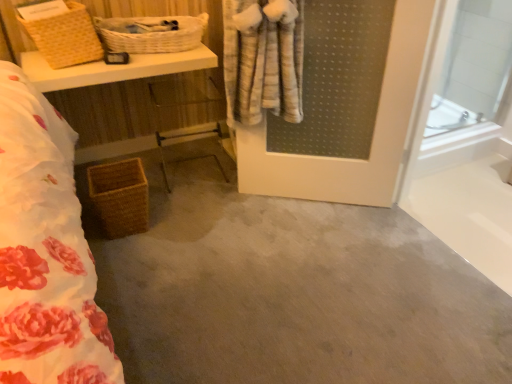
Question: Is woven brown basket at lower left, the third basket in the top-to-bottom sequence, positioned in front of woven wicker basket at lower left?

Choices:
 (A) yes
 (B) no

Answer: (B)

Question: From the image's perspective, is woven brown basket at lower left, which is counted as the 1th basket, starting from the bottom, beneath woven wicker basket at lower left?

Choices:
 (A) no
 (B) yes

Answer: (B)

Question: Is woven brown basket at lower left, the third basket in the top-to-bottom sequence, not close to woven wicker basket at lower left?

Choices:
 (A) yes
 (B) no

Answer: (B)

Question: Considering the relative sizes of woven brown basket at lower left, the third basket in the top-to-bottom sequence, and woven wicker basket at lower left in the image provided, is woven brown basket at lower left, the third basket in the top-to-bottom sequence, bigger than woven wicker basket at lower left?

Choices:
 (A) no
 (B) yes

Answer: (A)

Question: Is woven brown basket at lower left, which is counted as the 1th basket, starting from the bottom, to the right of woven wicker basket at lower left from the viewer's perspective?

Choices:
 (A) no
 (B) yes

Answer: (B)

Question: Is gray carpet at center to the left or to the right of woven brown basket at lower left, which is counted as the 1th basket, starting from the bottom, in the image?

Choices:
 (A) right
 (B) left

Answer: (A)

Question: In the image, is gray carpet at center positioned in front of or behind woven brown basket at lower left, the third basket in the top-to-bottom sequence?

Choices:
 (A) behind
 (B) front

Answer: (B)

Question: Is gray carpet at center spatially inside woven brown basket at lower left, the third basket in the top-to-bottom sequence, or outside of it?

Choices:
 (A) outside
 (B) inside

Answer: (A)

Question: Looking at their shapes, would you say gray carpet at center is wider or thinner than woven brown basket at lower left, which is counted as the 1th basket, starting from the bottom?

Choices:
 (A) thin
 (B) wide

Answer: (B)

Question: Looking at their shapes, would you say transparent glass door at right is wider or thinner than white wicker basket at upper left, which is the 3th basket in bottom-to-top order?

Choices:
 (A) thin
 (B) wide

Answer: (A)

Question: In terms of height, does transparent glass door at right look taller or shorter compared to white wicker basket at upper left, which is the 3th basket in bottom-to-top order?

Choices:
 (A) tall
 (B) short

Answer: (A)

Question: From a real-world perspective, relative to white wicker basket at upper left, which is counted as the 1th basket, starting from the top, is transparent glass door at right vertically above or below?

Choices:
 (A) above
 (B) below

Answer: (B)

Question: In terms of size, does transparent glass door at right appear bigger or smaller than white wicker basket at upper left, which is counted as the 1th basket, starting from the top?

Choices:
 (A) big
 (B) small

Answer: (A)

Question: Is white wicker basket at upper left, which is counted as the 1th basket, starting from the top, inside or outside of gray carpet at center?

Choices:
 (A) outside
 (B) inside

Answer: (A)

Question: Considering the relative positions of white wicker basket at upper left, which is counted as the 1th basket, starting from the top, and gray carpet at center in the image provided, is white wicker basket at upper left, which is counted as the 1th basket, starting from the top, to the left or to the right of gray carpet at center?

Choices:
 (A) right
 (B) left

Answer: (B)